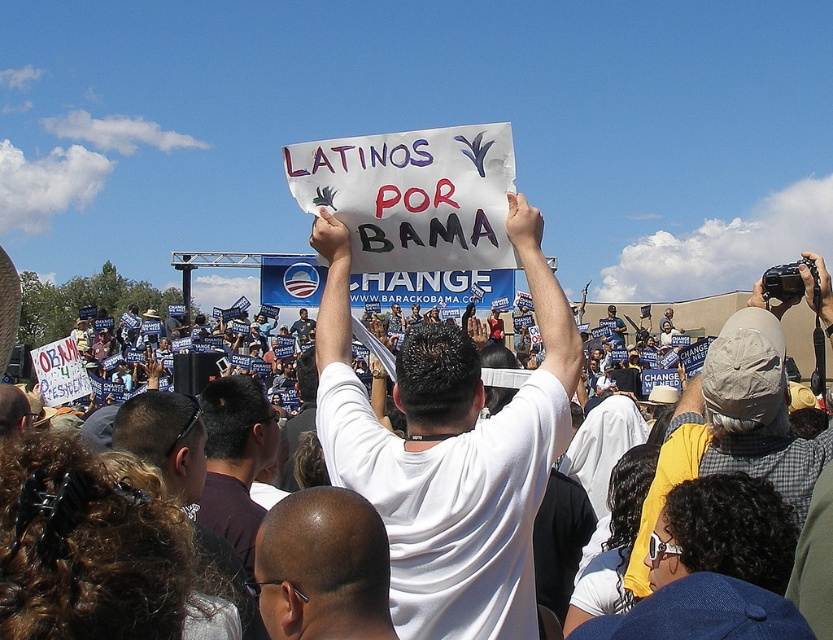
Question: Does bald head at center have a greater width compared to dark brown shirt at center?

Choices:
 (A) no
 (B) yes

Answer: (B)

Question: Which of the following is the closest to the observer?

Choices:
 (A) bald head at center
 (B) dark brown shirt at center

Answer: (A)

Question: Which of these objects is positioned farthest from the gray baseball cap at upper right?

Choices:
 (A) bald head at center
 (B) dark brown shirt at center

Answer: (B)

Question: Does gray baseball cap at upper right lie behind dark brown shirt at center?

Choices:
 (A) yes
 (B) no

Answer: (B)

Question: Which object is closer to the camera taking this photo?

Choices:
 (A) bald head at center
 (B) dark brown shirt at center
 (C) gray baseball cap at upper right

Answer: (A)

Question: Is white matte shirt at center to the right of gray baseball cap at upper right from the viewer's perspective?

Choices:
 (A) no
 (B) yes

Answer: (A)